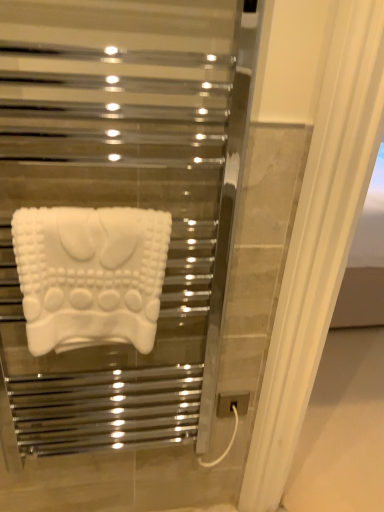
Question: Is point (39, 334) positioned closer to the camera than point (218, 404)?

Choices:
 (A) farther
 (B) closer

Answer: (B)

Question: Visually, is white matte towel at center positioned to the left or to the right of gray matte electric outlet at lower right?

Choices:
 (A) right
 (B) left

Answer: (B)

Question: From their relative heights in the image, would you say white matte towel at center is taller or shorter than gray matte electric outlet at lower right?

Choices:
 (A) tall
 (B) short

Answer: (A)

Question: Relative to white matte towel at center, is gray matte electric outlet at lower right in front or behind?

Choices:
 (A) front
 (B) behind

Answer: (B)

Question: From a real-world perspective, relative to white matte towel at center, is gray matte electric outlet at lower right vertically above or below?

Choices:
 (A) below
 (B) above

Answer: (A)

Question: Considering the positions of gray matte electric outlet at lower right and white matte towel at center in the image, is gray matte electric outlet at lower right bigger or smaller than white matte towel at center?

Choices:
 (A) small
 (B) big

Answer: (A)

Question: Is gray matte electric outlet at lower right to the left or to the right of white matte towel at center in the image?

Choices:
 (A) right
 (B) left

Answer: (A)